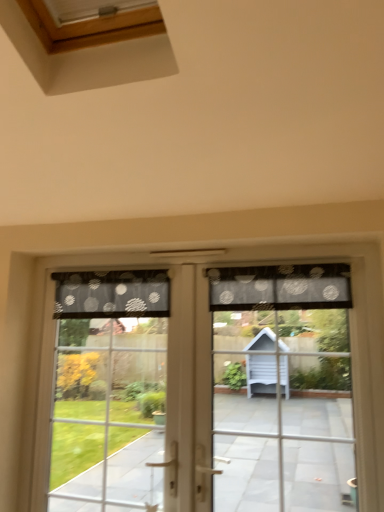
You are a GUI agent. You are given a task and a screenshot of the screen. Output one action in this format:
    pyautogui.click(x=<x>, y=<y>)
    Task: Click on the free space above translucent polka dot curtain at center (from a real-world perspective)
    Image resolution: width=384 pixels, height=512 pixels.
    Given the screenshot: What is the action you would take?
    pyautogui.click(x=271, y=257)